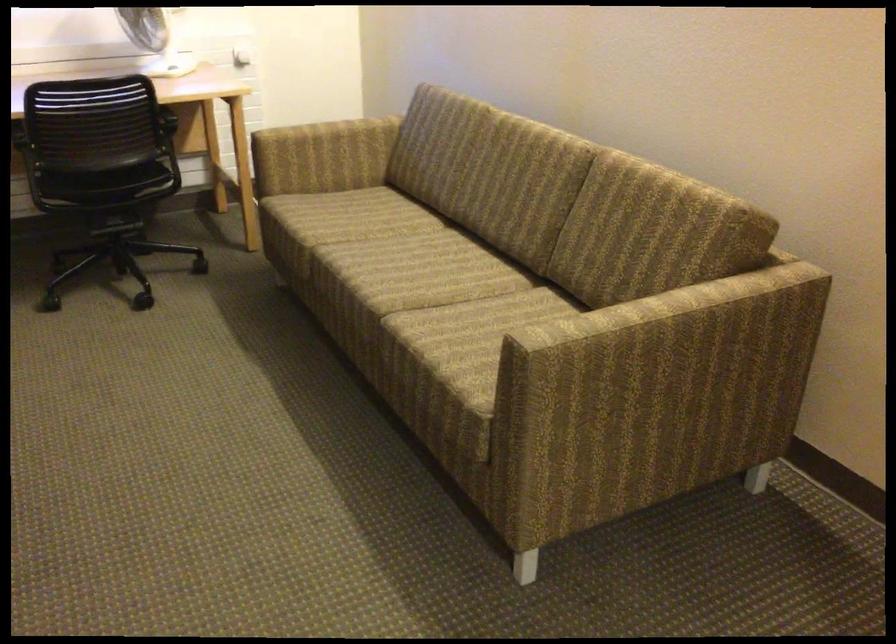
What do you see at coordinates (167, 120) in the screenshot? This screenshot has height=644, width=896. I see `a black chair armrest` at bounding box center [167, 120].